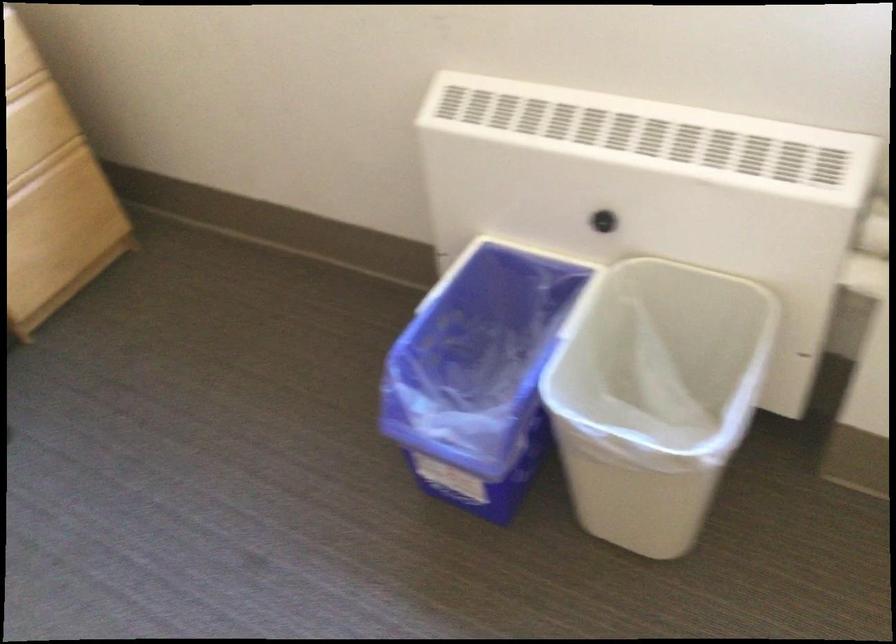
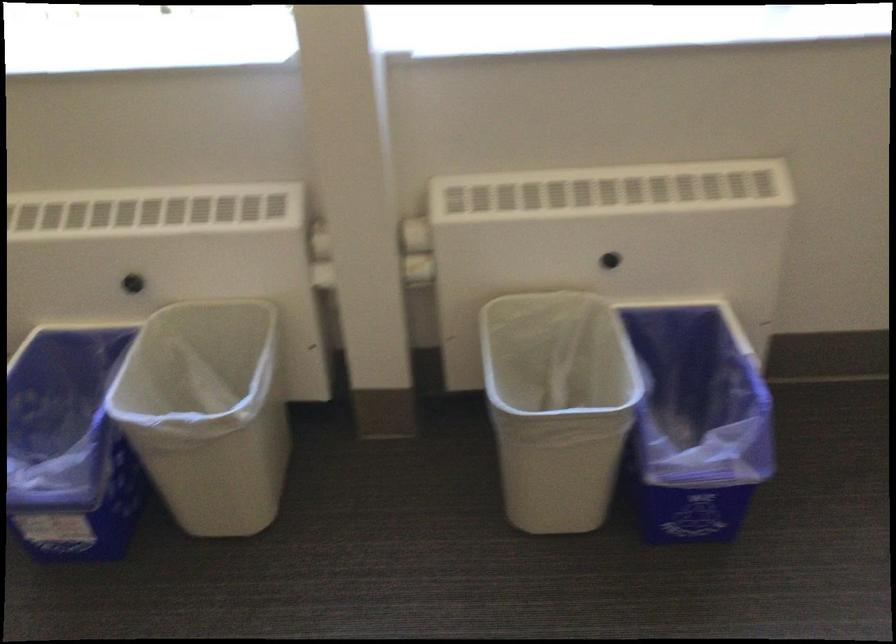
Find the pixel in the second image that matches [643,395] in the first image.

(208, 413)